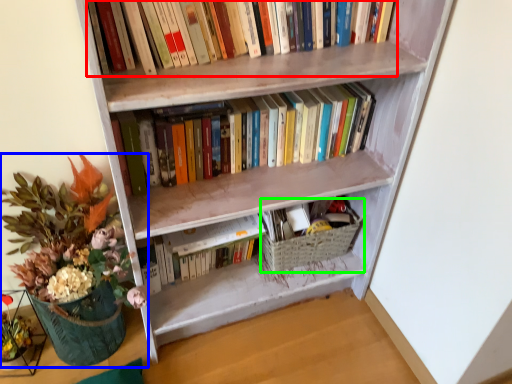
Question: Based on their relative distances, which object is farther from book (highlighted by a red box)? Choose from houseplant (highlighted by a blue box) and basket (highlighted by a green box).

Choices:
 (A) houseplant
 (B) basket

Answer: (B)